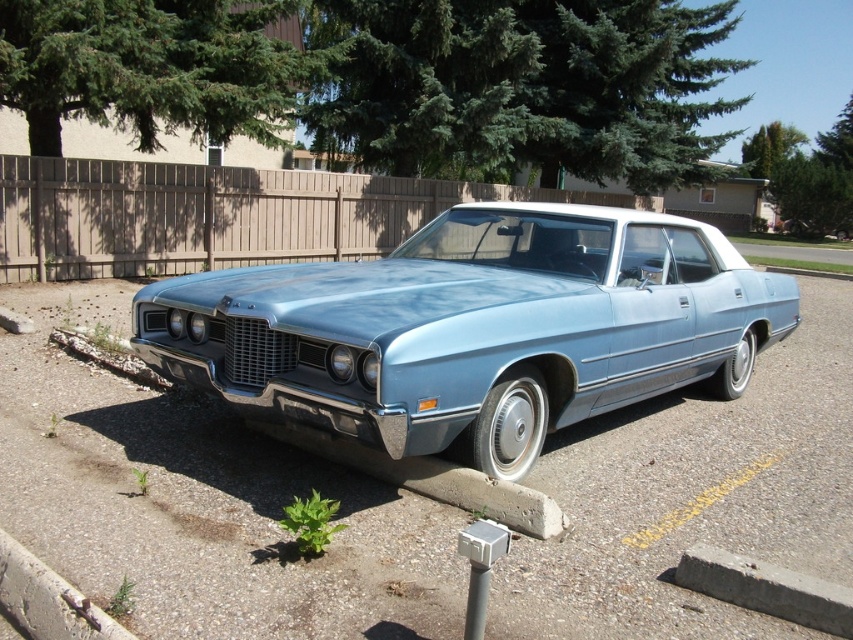
Is metallic blue car at center smaller than concrete at lower left?

Incorrect, metallic blue car at center is not smaller in size than concrete at lower left.

Is metallic blue car at center in front of concrete at lower left?

That is False.

Locate an element on the screen. This screenshot has width=853, height=640. metallic blue car at center is located at coordinates (201, 502).

Is metallic blue car at center closer to camera compared to light blue metallic car at center?

Yes, metallic blue car at center is in front of light blue metallic car at center.

From the picture: Is metallic blue car at center taller than light blue metallic car at center?

Yes.

Image resolution: width=853 pixels, height=640 pixels. Describe the element at coordinates (201, 502) in the screenshot. I see `metallic blue car at center` at that location.

This screenshot has width=853, height=640. I want to click on metallic blue car at center, so click(x=201, y=502).

Who is lower down, light blue metallic car at center or concrete at lower left?

concrete at lower left is lower down.

Does light blue metallic car at center appear on the left side of concrete at lower left?

Incorrect, light blue metallic car at center is not on the left side of concrete at lower left.

Measure the distance between light blue metallic car at center and camera.

A distance of 12.06 feet exists between light blue metallic car at center and camera.

Find the location of a particular element. This screenshot has height=640, width=853. light blue metallic car at center is located at coordinates (474, 328).